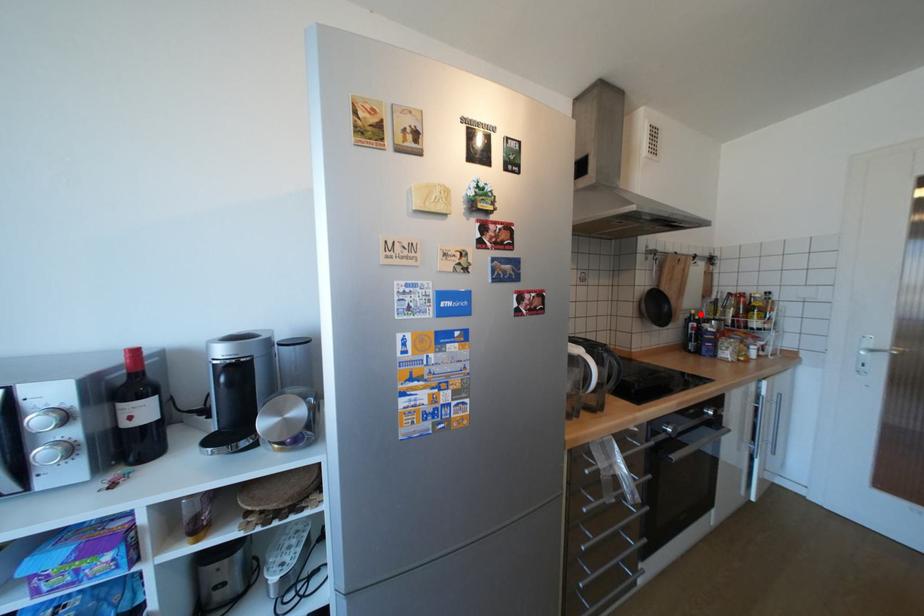
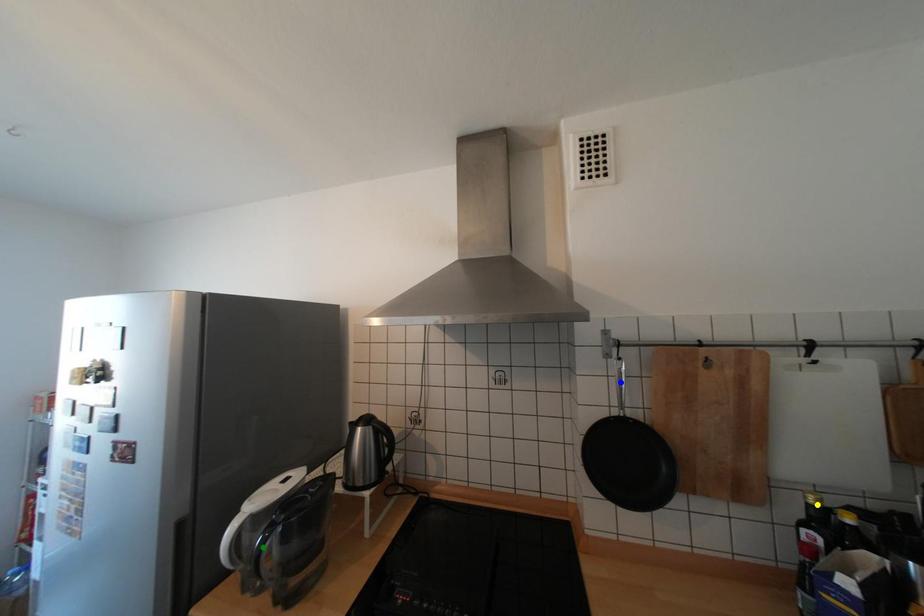
Question: I am providing you with two images of the same scene from different viewpoints. A red point is marked on the first image. You are given multiple points on the second image. Which point in image 2 represents the same 3d spot as the red point in image 1?

Choices:
 (A) blue point
 (B) yellow point
 (C) green point

Answer: (B)